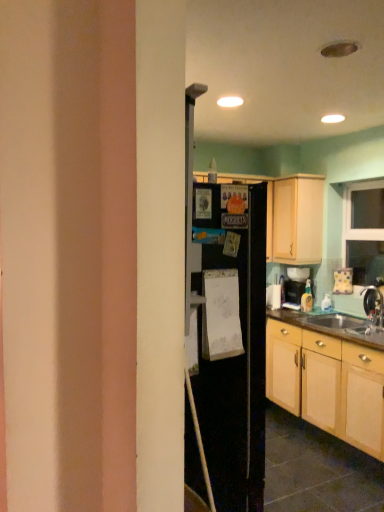
Question: Can you confirm if brown wood countertop at lower right is smaller than metallic silver faucet at lower right?

Choices:
 (A) no
 (B) yes

Answer: (A)

Question: Can you confirm if brown wood countertop at lower right is positioned to the left of metallic silver faucet at lower right?

Choices:
 (A) yes
 (B) no

Answer: (A)

Question: Could you tell me if brown wood countertop at lower right is facing metallic silver faucet at lower right?

Choices:
 (A) yes
 (B) no

Answer: (B)

Question: Does brown wood countertop at lower right have a larger size compared to metallic silver faucet at lower right?

Choices:
 (A) yes
 (B) no

Answer: (A)

Question: Is brown wood countertop at lower right thinner than metallic silver faucet at lower right?

Choices:
 (A) yes
 (B) no

Answer: (B)

Question: From a real-world perspective, relative to light wood cabinet at upper right, which is counted as the second cabinetry, starting from the bottom, is light wood cabinet at lower right, the second cabinetry when ordered from top to bottom, vertically above or below?

Choices:
 (A) above
 (B) below

Answer: (B)

Question: From the image's perspective, relative to light wood cabinet at upper right, which is the 1th cabinetry in top-to-bottom order, is light wood cabinet at lower right, the 1th cabinetry in the bottom-to-top sequence, above or below?

Choices:
 (A) below
 (B) above

Answer: (A)

Question: Considering the positions of light wood cabinet at lower right, the second cabinetry when ordered from top to bottom, and light wood cabinet at upper right, which is counted as the second cabinetry, starting from the bottom, in the image, is light wood cabinet at lower right, the second cabinetry when ordered from top to bottom, taller or shorter than light wood cabinet at upper right, which is counted as the second cabinetry, starting from the bottom,?

Choices:
 (A) tall
 (B) short

Answer: (A)

Question: Visually, is light wood cabinet at lower right, the second cabinetry when ordered from top to bottom, positioned to the left or to the right of light wood cabinet at upper right, which is the 1th cabinetry in top-to-bottom order?

Choices:
 (A) right
 (B) left

Answer: (A)

Question: Would you say brown wood countertop at lower right is inside or outside metallic silver faucet at lower right?

Choices:
 (A) inside
 (B) outside

Answer: (B)

Question: From a real-world perspective, is brown wood countertop at lower right physically located above or below metallic silver faucet at lower right?

Choices:
 (A) above
 (B) below

Answer: (B)

Question: In terms of height, does brown wood countertop at lower right look taller or shorter compared to metallic silver faucet at lower right?

Choices:
 (A) tall
 (B) short

Answer: (B)

Question: In the image, is brown wood countertop at lower right on the left side or the right side of metallic silver faucet at lower right?

Choices:
 (A) right
 (B) left

Answer: (B)

Question: Would you say brown wood countertop at lower right is to the left or to the right of light wood cabinet at lower right, the 1th cabinetry in the bottom-to-top sequence, in the picture?

Choices:
 (A) left
 (B) right

Answer: (B)

Question: Is brown wood countertop at lower right bigger or smaller than light wood cabinet at lower right, the second cabinetry when ordered from top to bottom?

Choices:
 (A) small
 (B) big

Answer: (A)